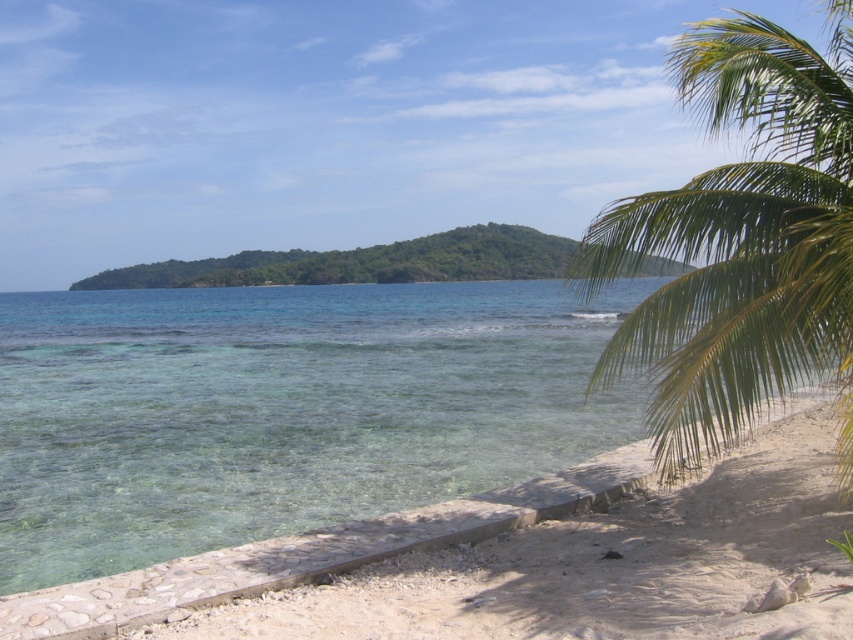
Is green leafy palm tree at right wider than green leafy island at center?

In fact, green leafy palm tree at right might be narrower than green leafy island at center.

Does point (845, 465) lie in front of point (244, 252)?

Yes, point (845, 465) is closer to viewer.

You are a GUI agent. You are given a task and a screenshot of the screen. Output one action in this format:
    pyautogui.click(x=<x>, y=<y>)
    Task: Click on the green leafy palm tree at right
    
    Given the screenshot: What is the action you would take?
    pyautogui.click(x=741, y=241)

In the scene shown: How far apart are white sandy beach at lower right and green leafy island at center?

white sandy beach at lower right is 163.22 feet away from green leafy island at center.

Who is more forward, (561,616) or (184,260)?

Point (561,616)

Is point (729, 470) in front of point (339, 273)?

Yes, point (729, 470) is closer to viewer.

Where is `white sandy beach at lower right`? white sandy beach at lower right is located at coordinates (601, 566).

Where is `green leafy palm tree at right`? This screenshot has width=853, height=640. green leafy palm tree at right is located at coordinates (741, 241).

Is green leafy palm tree at right taller than white sandy beach at lower right?

Indeed, green leafy palm tree at right has a greater height compared to white sandy beach at lower right.

This screenshot has height=640, width=853. Describe the element at coordinates (741, 241) in the screenshot. I see `green leafy palm tree at right` at that location.

At what (x,y) coordinates should I click in order to perform the action: click on green leafy palm tree at right. Please return your answer as a coordinate pair (x, y). The width and height of the screenshot is (853, 640). Looking at the image, I should click on (741, 241).